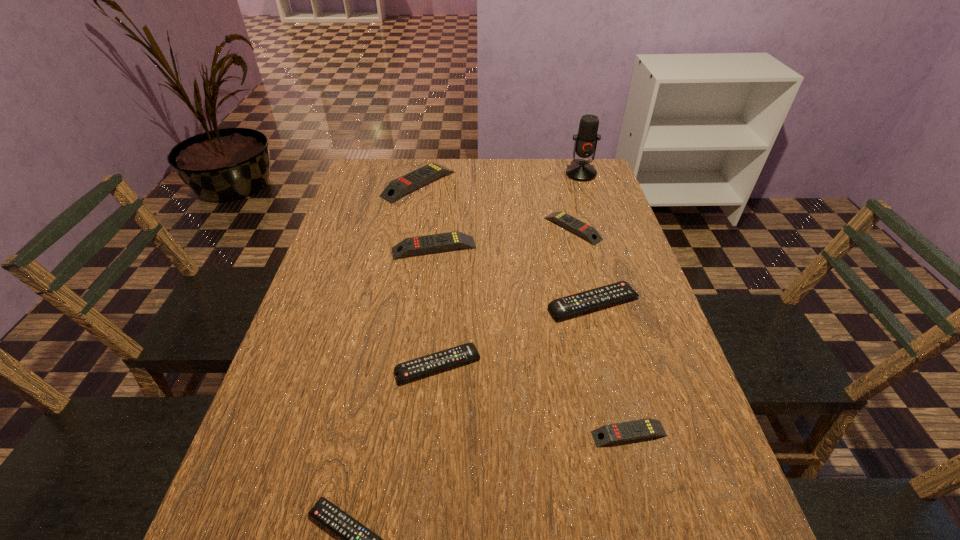
Identify the location of free point between the farthest black remote control and the third tallest object. pyautogui.click(x=514, y=276).

This screenshot has height=540, width=960. I want to click on free space between the third nearest remote control and the microphone, so click(x=510, y=269).

Locate an element on the screen. unoccupied position between the third biggest yellow remote control and the second tallest object is located at coordinates (495, 206).

In order to click on vacant point located between the fourth nearest remote control and the second nearest black remote control in this screenshot , I will do `click(516, 334)`.

Locate an element on the screen. The image size is (960, 540). vacant point located between the tallest remote control and the third biggest yellow remote control is located at coordinates (495, 206).

At what (x,y) coordinates should I click in order to perform the action: click on free space between the farthest yellow remote control and the second nearest black remote control. Please return your answer as a coordinate pair (x, y). Image resolution: width=960 pixels, height=540 pixels. Looking at the image, I should click on (428, 275).

Identify which object is the seventh closest to the rightmost black remote control. Please provide its 2D coordinates. Your answer should be formatted as a tuple, i.e. [(x, y)], where the tuple contains the x and y coordinates of a point satisfying the conditions above.

[(585, 145)]

Point out which object is positioned as the fourth nearest to the smallest yellow remote control. Please provide its 2D coordinates. Your answer should be formatted as a tuple, i.e. [(x, y)], where the tuple contains the x and y coordinates of a point satisfying the conditions above.

[(452, 240)]

Find the location of a particular element. the sixth closest remote control to the farthest remote control is located at coordinates (357, 539).

Locate an element on the screen. The height and width of the screenshot is (540, 960). remote control that stands as the closest to the smallest yellow remote control is located at coordinates (444, 359).